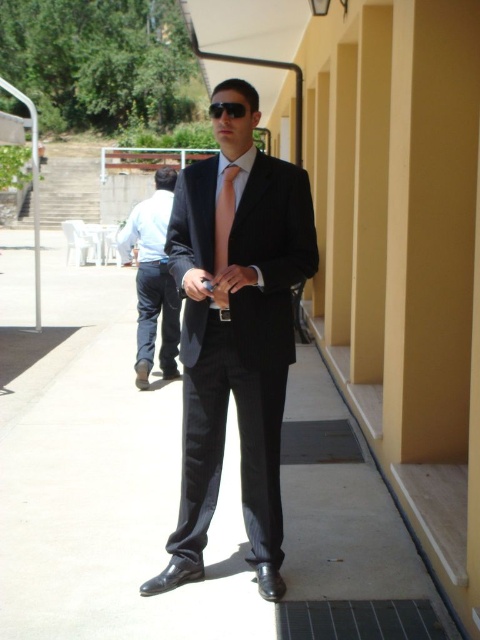
Question: Which of the following is the closest to the observer?

Choices:
 (A) black pinstripe suit at center
 (B) pink silk tie at center

Answer: (B)

Question: Can you confirm if black pinstripe suit at center is wider than black plastic goggles at center?

Choices:
 (A) no
 (B) yes

Answer: (A)

Question: Can you confirm if pink silk tie at center is positioned above black plastic goggles at center?

Choices:
 (A) no
 (B) yes

Answer: (A)

Question: Among these points, which one is farthest from the camera?

Choices:
 (A) (111, 440)
 (B) (211, 113)

Answer: (A)

Question: Which object appears farthest from the camera in this image?

Choices:
 (A) pink silk tie at center
 (B) black pinstripe suit at center

Answer: (B)

Question: Does smooth concrete pavement at center have a greater width compared to black pinstripe suit at center?

Choices:
 (A) yes
 (B) no

Answer: (A)